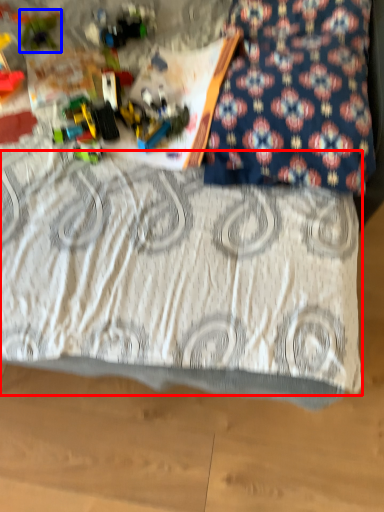
Question: Which of the following is the farthest to the observer, bedding (highlighted by a red box) or toy (highlighted by a blue box)?

Choices:
 (A) bedding
 (B) toy

Answer: (B)